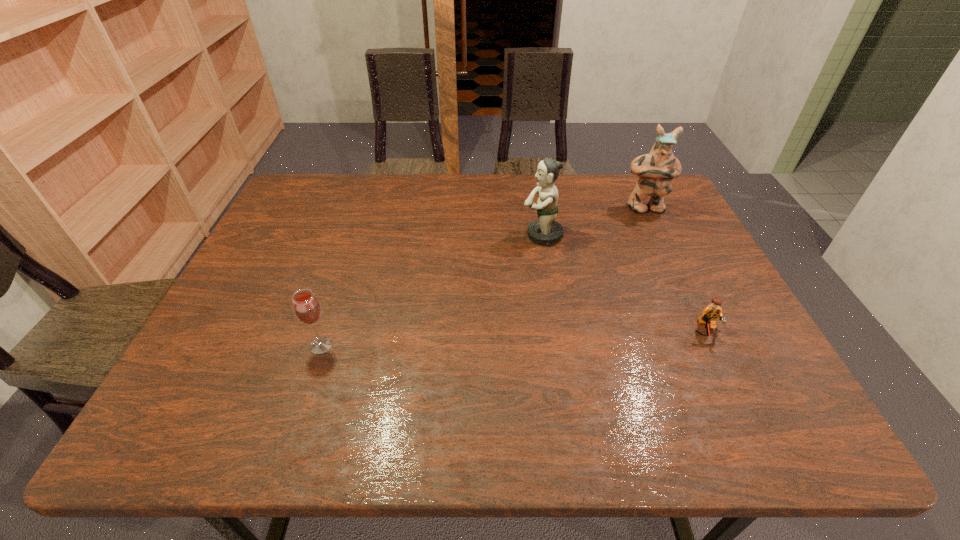
Find the location of `free space between the second object from left to right and the third tallest object`. free space between the second object from left to right and the third tallest object is located at coordinates (432, 290).

The height and width of the screenshot is (540, 960). I want to click on unoccupied area between the nearer figurine and the farther figurine, so click(593, 221).

At what (x,y) coordinates should I click in order to perform the action: click on vacant point located between the leftmost object and the right figurine. Please return your answer as a coordinate pair (x, y). The image size is (960, 540). Looking at the image, I should click on (483, 276).

Identify which object is the closest to the nearer figurine. Please provide its 2D coordinates. Your answer should be formatted as a tuple, i.e. [(x, y)], where the tuple contains the x and y coordinates of a point satisfying the conditions above.

[(655, 170)]

Select which object appears as the third closest to the left figurine. Please provide its 2D coordinates. Your answer should be formatted as a tuple, i.e. [(x, y)], where the tuple contains the x and y coordinates of a point satisfying the conditions above.

[(306, 306)]

Identify the location of vacant region that satisfies the following two spatial constraints: 1. on the front-facing side of the right figurine; 2. on the front-facing side of the left figurine. (658, 235).

Locate an element on the screen. The height and width of the screenshot is (540, 960). vacant space that satisfies the following two spatial constraints: 1. on the front-facing side of the left figurine; 2. on the front side of the wineglass is located at coordinates (561, 345).

I want to click on vacant space that satisfies the following two spatial constraints: 1. on the front-facing side of the farthest object; 2. on the front-facing side of the second object from left to right, so click(x=658, y=235).

What are the coordinates of `free space that satisfies the following two spatial constraints: 1. on the front-facing side of the farther figurine; 2. on the front-facing side of the left figurine` in the screenshot? It's located at (658, 235).

Locate an element on the screen. vacant space that satisfies the following two spatial constraints: 1. on the front-facing side of the farther figurine; 2. on the front-facing side of the second object from left to right is located at coordinates pos(658,235).